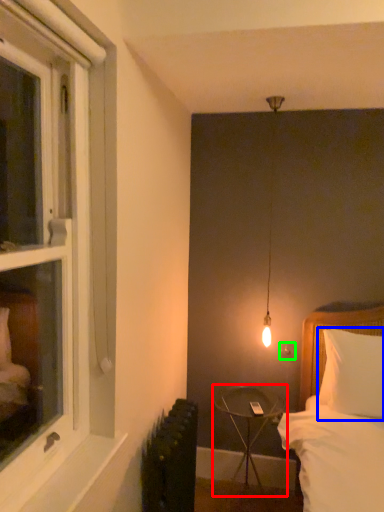
Question: Which object is positioned closest to table (highlighted by a red box)? Select from pillow (highlighted by a blue box) and electric outlet (highlighted by a green box).

Choices:
 (A) pillow
 (B) electric outlet

Answer: (B)